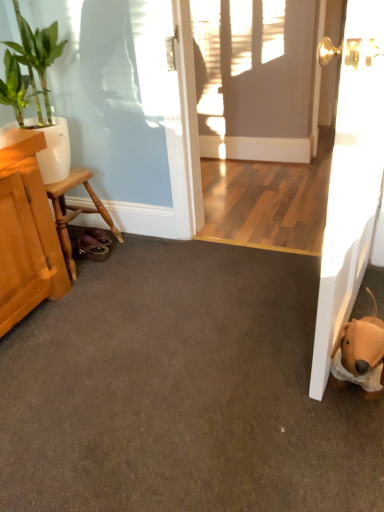
This screenshot has width=384, height=512. What are the coordinates of `free space in front of wooden stool at left` in the screenshot? It's located at (99, 294).